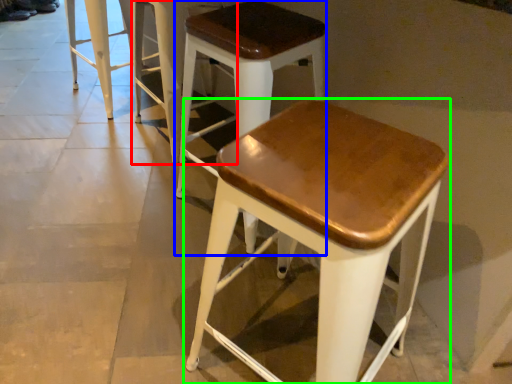
Question: Based on their relative distances, which object is farther from stool (highlighted by a red box)? Choose from stool (highlighted by a blue box) and stool (highlighted by a green box).

Choices:
 (A) stool
 (B) stool

Answer: (B)